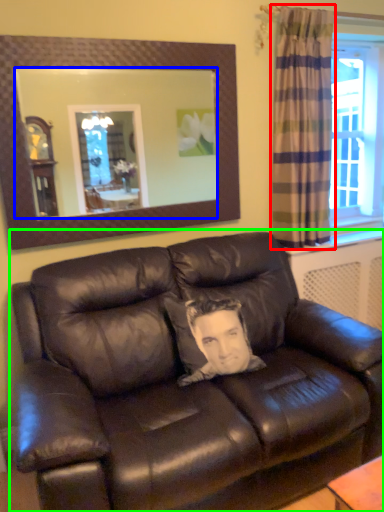
Question: Which object is the farthest from curtain (highlighted by a red box)? Choose among these: mirror (highlighted by a blue box) or studio couch (highlighted by a green box).

Choices:
 (A) mirror
 (B) studio couch

Answer: (A)